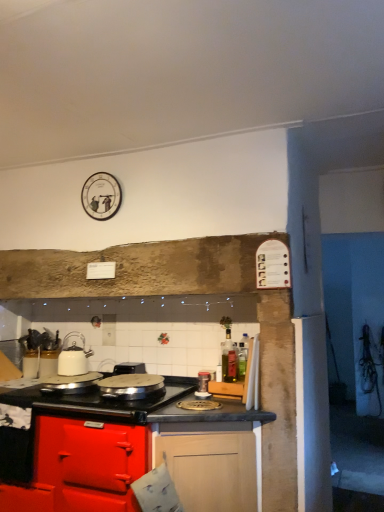
Question: Considering the relative positions of black plastic toaster at center and white glossy kettle at left, marked as the second kitchen appliance in a left-to-right arrangement, in the image provided, is black plastic toaster at center to the right of white glossy kettle at left, marked as the second kitchen appliance in a left-to-right arrangement, from the viewer's perspective?

Choices:
 (A) yes
 (B) no

Answer: (A)

Question: Is black plastic toaster at center not within white glossy kettle at left, marked as the second kitchen appliance in a right-to-left arrangement?

Choices:
 (A) no
 (B) yes

Answer: (B)

Question: Considering the relative sizes of black plastic toaster at center and white glossy kettle at left, marked as the second kitchen appliance in a left-to-right arrangement, in the image provided, is black plastic toaster at center smaller than white glossy kettle at left, marked as the second kitchen appliance in a left-to-right arrangement,?

Choices:
 (A) yes
 (B) no

Answer: (A)

Question: From the image's perspective, would you say black plastic toaster at center is shown under white glossy kettle at left, marked as the second kitchen appliance in a left-to-right arrangement?

Choices:
 (A) yes
 (B) no

Answer: (A)

Question: From a real-world perspective, is black plastic toaster at center located higher than white glossy kettle at left, marked as the second kitchen appliance in a left-to-right arrangement?

Choices:
 (A) no
 (B) yes

Answer: (A)

Question: Can you confirm if black plastic toaster at center is thinner than white glossy kettle at left, marked as the second kitchen appliance in a left-to-right arrangement?

Choices:
 (A) no
 (B) yes

Answer: (A)

Question: Can you confirm if shiny silver pan at center, placed as the 3th kitchen appliance when sorted from right to left, is wider than metallic silver canister at center, which appears as the third kitchen appliance when viewed from the left?

Choices:
 (A) no
 (B) yes

Answer: (B)

Question: From a real-world perspective, does shiny silver pan at center, placed as the 3th kitchen appliance when sorted from right to left, stand above metallic silver canister at center, the 1th kitchen appliance from the right?

Choices:
 (A) yes
 (B) no

Answer: (A)

Question: Considering the relative sizes of shiny silver pan at center, the 1th kitchen appliance from the left, and metallic silver canister at center, which appears as the third kitchen appliance when viewed from the left, in the image provided, is shiny silver pan at center, the 1th kitchen appliance from the left, thinner than metallic silver canister at center, which appears as the third kitchen appliance when viewed from the left,?

Choices:
 (A) no
 (B) yes

Answer: (A)

Question: Is the surface of shiny silver pan at center, placed as the 3th kitchen appliance when sorted from right to left, in direct contact with metallic silver canister at center, the 1th kitchen appliance from the right?

Choices:
 (A) yes
 (B) no

Answer: (B)

Question: Considering the relative positions of shiny silver pan at center, placed as the 3th kitchen appliance when sorted from right to left, and metallic silver canister at center, the 1th kitchen appliance from the right, in the image provided, is shiny silver pan at center, placed as the 3th kitchen appliance when sorted from right to left, to the left of metallic silver canister at center, the 1th kitchen appliance from the right, from the viewer's perspective?

Choices:
 (A) no
 (B) yes

Answer: (B)

Question: Is shiny silver pan at center, the 1th kitchen appliance from the left, positioned beyond the bounds of metallic silver canister at center, the 1th kitchen appliance from the right?

Choices:
 (A) yes
 (B) no

Answer: (A)

Question: From a real-world perspective, is shiny silver pan at center, placed as the 3th kitchen appliance when sorted from right to left, below glossy wood cabinet at lower center?

Choices:
 (A) yes
 (B) no

Answer: (B)